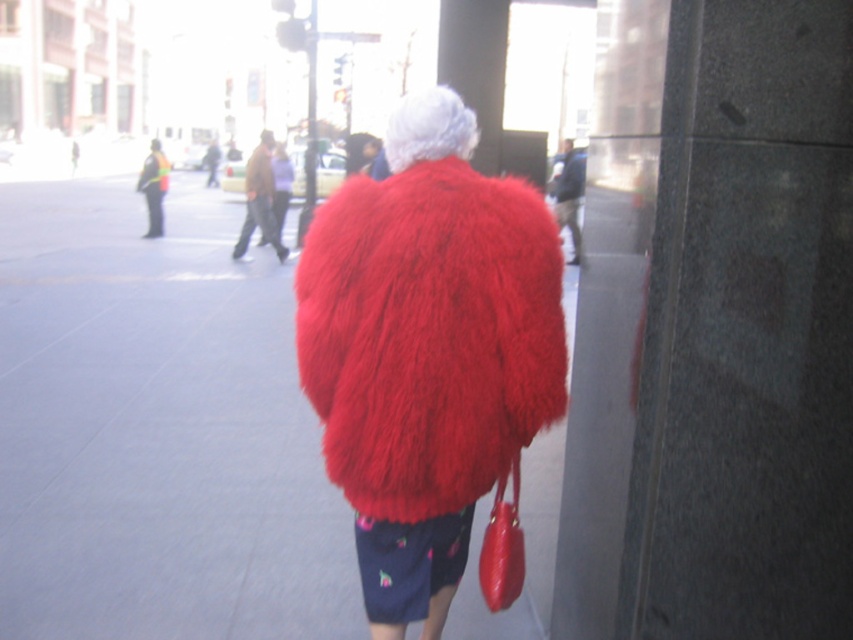
Question: Can you confirm if red fluffy coat at center is wider than shiny red handbag at lower right?

Choices:
 (A) yes
 (B) no

Answer: (A)

Question: Which point appears closest to the camera in this image?

Choices:
 (A) (497, 524)
 (B) (149, 540)

Answer: (A)

Question: Which of these objects is positioned closest to the red fluffy coat at center?

Choices:
 (A) fuzzy red coat at center
 (B) shiny red handbag at lower right

Answer: (B)

Question: Does red fluffy coat at center appear on the right side of shiny red handbag at lower right?

Choices:
 (A) no
 (B) yes

Answer: (A)

Question: Does fuzzy red coat at center appear over shiny red handbag at lower right?

Choices:
 (A) no
 (B) yes

Answer: (B)

Question: Considering the real-world distances, which object is farthest from the fuzzy red coat at center?

Choices:
 (A) red fluffy coat at center
 (B) shiny red handbag at lower right

Answer: (A)